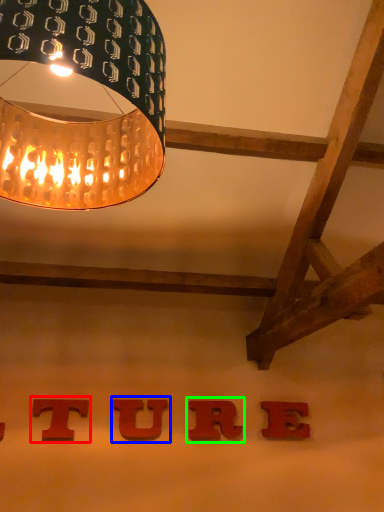
Question: Based on their relative distances, which object is nearer to alphabet (highlighted by a red box)? Choose from alphabet (highlighted by a blue box) and alphabet (highlighted by a green box).

Choices:
 (A) alphabet
 (B) alphabet

Answer: (A)